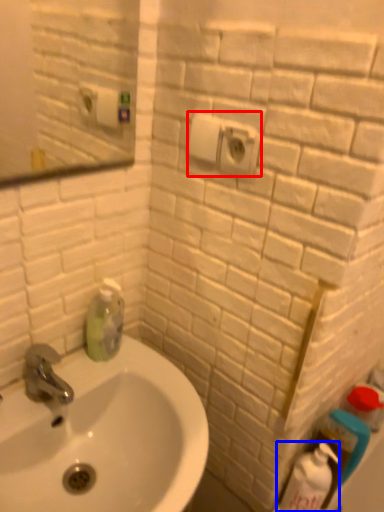
Question: Which of the following is the farthest to the observer, electric outlet (highlighted by a red box) or cleaning product (highlighted by a blue box)?

Choices:
 (A) electric outlet
 (B) cleaning product

Answer: (B)